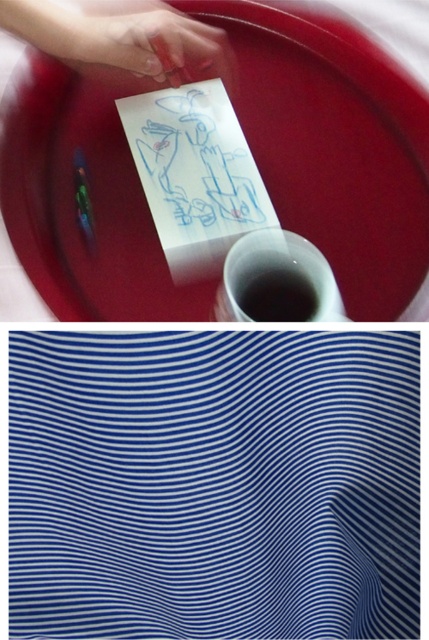
Who is lower down, smooth skin hand at upper left or black matte liquid at center?

Positioned lower is black matte liquid at center.

Does smooth skin hand at upper left appear on the right side of black matte liquid at center?

Incorrect, smooth skin hand at upper left is not on the right side of black matte liquid at center.

Who is more distant from viewer, (199, 48) or (247, 304)?

The point (199, 48) is behind.

This screenshot has width=429, height=640. In order to click on smooth skin hand at upper left in this screenshot , I will do `click(163, 49)`.